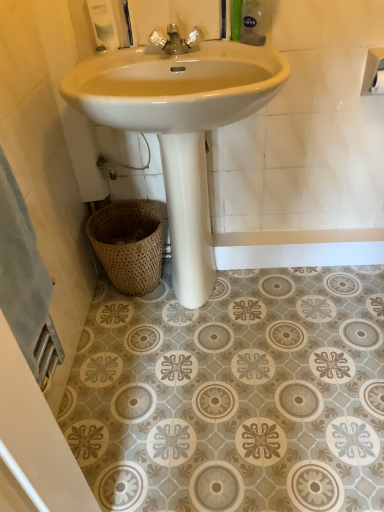
Question: Is white glossy soap dispenser at upper left, which is the first toiletry from left to right, facing away from woven natural basket at lower left?

Choices:
 (A) yes
 (B) no

Answer: (B)

Question: Does white glossy soap dispenser at upper left, the second toiletry viewed from the right, come behind woven natural basket at lower left?

Choices:
 (A) no
 (B) yes

Answer: (A)

Question: Can you confirm if white glossy soap dispenser at upper left, the second toiletry viewed from the right, is wider than woven natural basket at lower left?

Choices:
 (A) no
 (B) yes

Answer: (A)

Question: Is white glossy soap dispenser at upper left, which is the first toiletry from left to right, to the left of woven natural basket at lower left from the viewer's perspective?

Choices:
 (A) no
 (B) yes

Answer: (B)

Question: From the image's perspective, would you say white glossy soap dispenser at upper left, which is the first toiletry from left to right, is positioned over woven natural basket at lower left?

Choices:
 (A) no
 (B) yes

Answer: (B)

Question: Is chrome metallic faucet at center taller or shorter than white matte toilet paper at upper right, the 2th toilet paper viewed from the front?

Choices:
 (A) short
 (B) tall

Answer: (B)

Question: In the image, is chrome metallic faucet at center positioned in front of or behind white matte toilet paper at upper right, which ranks as the first toilet paper in back-to-front order?

Choices:
 (A) behind
 (B) front

Answer: (B)

Question: Is point (160, 47) positioned closer to the camera than point (374, 79)?

Choices:
 (A) closer
 (B) farther

Answer: (A)

Question: Visually, is chrome metallic faucet at center positioned to the left or to the right of white matte toilet paper at upper right, the 2th toilet paper viewed from the front?

Choices:
 (A) left
 (B) right

Answer: (A)

Question: Considering the relative positions of woven natural basket at lower left and white glossy soap dispenser at upper left, which is the first toiletry from left to right, in the image provided, is woven natural basket at lower left to the left or to the right of white glossy soap dispenser at upper left, which is the first toiletry from left to right,?

Choices:
 (A) left
 (B) right

Answer: (B)

Question: Looking at the image, does woven natural basket at lower left seem bigger or smaller compared to white glossy soap dispenser at upper left, the second toiletry viewed from the right?

Choices:
 (A) small
 (B) big

Answer: (B)

Question: From a real-world perspective, is woven natural basket at lower left physically located above or below white glossy soap dispenser at upper left, the second toiletry viewed from the right?

Choices:
 (A) above
 (B) below

Answer: (B)

Question: From the image's perspective, relative to white glossy soap dispenser at upper left, the second toiletry viewed from the right, is woven natural basket at lower left above or below?

Choices:
 (A) above
 (B) below

Answer: (B)

Question: From the image's perspective, is white glossy sink at center above or below white matte toilet paper at upper right, which ranks as the first toilet paper in front-to-back order?

Choices:
 (A) below
 (B) above

Answer: (A)

Question: Considering their positions, is white glossy sink at center located in front of or behind white matte toilet paper at upper right, which ranks as the first toilet paper in front-to-back order?

Choices:
 (A) front
 (B) behind

Answer: (A)